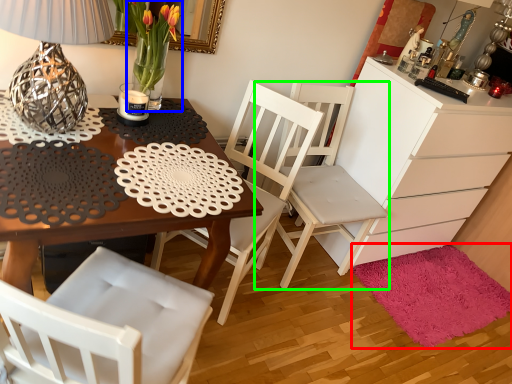
Question: Which is farther away from mat (highlighted by a red box)? floral arrangement (highlighted by a blue box) or chair (highlighted by a green box)?

Choices:
 (A) floral arrangement
 (B) chair

Answer: (A)